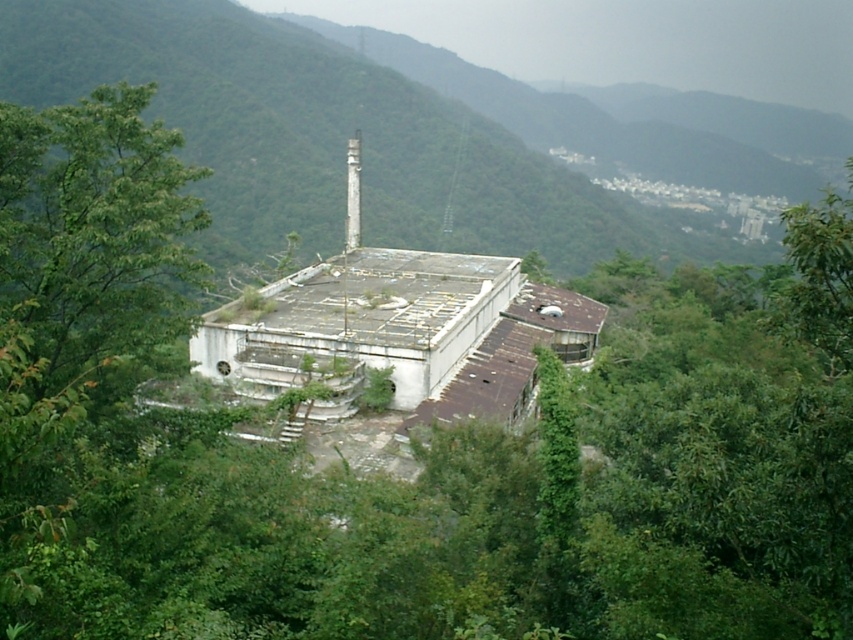
You are a hiker who has stumbled upon this abandoned industrial site. You notice the green mossy roof at center and the white smooth chimney at center. Which object is located to the right of the other?

The green mossy roof at center is positioned on the right side of white smooth chimney at center, so the green mossy roof at center is to the right of the white smooth chimney at center.

You are a surveyor measuring distances between structures in an abandoned industrial site. You have a drone that can fly up to 100 meters. If you want to fly the drone from the green mossy roof at center to the white smooth chimney at center, will the drone be able to make the trip without exceeding its maximum range?

The distance between the green mossy roof at center and the white smooth chimney at center is 90.49 meters, which is under the drone maximum range of 100 meters. The drone can make the trip.